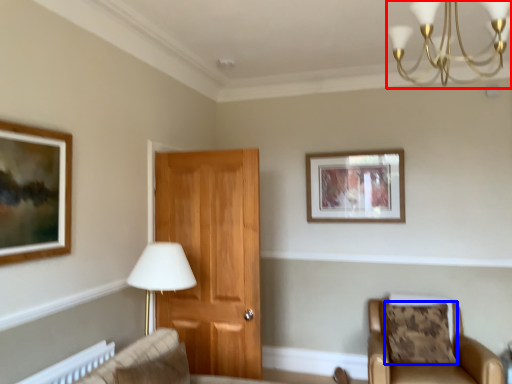
Question: Which object appears closest to the camera in this image, light fixture (highlighted by a red box) or pillow (highlighted by a blue box)?

Choices:
 (A) light fixture
 (B) pillow

Answer: (A)